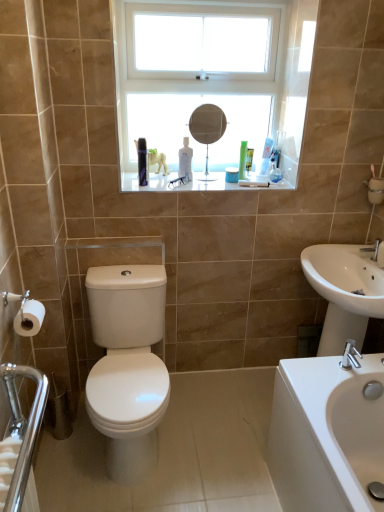
Question: Is white glass window at upper center at the back of translucent plastic toothbrush at upper center, the 2th toiletry positioned from the front?

Choices:
 (A) no
 (B) yes

Answer: (B)

Question: From the image's perspective, would you say translucent plastic toothbrush at upper center, which is counted as the 2th toiletry, starting from the bottom, is positioned over white glass window at upper center?

Choices:
 (A) yes
 (B) no

Answer: (B)

Question: From a real-world perspective, is translucent plastic toothbrush at upper center, the 2th toiletry positioned from the front, over white glass window at upper center?

Choices:
 (A) yes
 (B) no

Answer: (B)

Question: Can you confirm if translucent plastic toothbrush at upper center, which is the 2th toiletry from left to right, is wider than white glass window at upper center?

Choices:
 (A) yes
 (B) no

Answer: (B)

Question: Is the position of translucent plastic toothbrush at upper center, which is the 2th toiletry from left to right, less distant than that of white glass window at upper center?

Choices:
 (A) yes
 (B) no

Answer: (B)

Question: Visually, is white glossy sink at lower right, which appears as the first sink when ordered from the bottom, positioned to the left or to the right of polished chrome grab bar at lower left?

Choices:
 (A) right
 (B) left

Answer: (A)

Question: Is white glossy sink at lower right, which is the 2th sink in top-to-bottom order, wider or thinner than polished chrome grab bar at lower left?

Choices:
 (A) wide
 (B) thin

Answer: (A)

Question: Is point (306, 419) closer or farther from the camera than point (21, 471)?

Choices:
 (A) farther
 (B) closer

Answer: (A)

Question: Is white glossy sink at lower right, which is the 2th sink in top-to-bottom order, in front of or behind polished chrome grab bar at lower left in the image?

Choices:
 (A) front
 (B) behind

Answer: (B)

Question: In terms of width, does matte silver mirror at center look wider or thinner when compared to white glossy sink at right, the second sink in the bottom-to-top sequence?

Choices:
 (A) thin
 (B) wide

Answer: (A)

Question: Relative to white glossy sink at right, acting as the first sink starting from the top, is matte silver mirror at center in front or behind?

Choices:
 (A) behind
 (B) front

Answer: (A)

Question: From their relative heights in the image, would you say matte silver mirror at center is taller or shorter than white glossy sink at right, acting as the first sink starting from the top?

Choices:
 (A) tall
 (B) short

Answer: (A)

Question: From the image's perspective, is matte silver mirror at center positioned above or below white glossy sink at right, acting as the first sink starting from the top?

Choices:
 (A) above
 (B) below

Answer: (A)

Question: In terms of width, does white glass window at upper center look wider or thinner when compared to matte silver mirror at center?

Choices:
 (A) thin
 (B) wide

Answer: (B)

Question: In the image, is white glass window at upper center on the left side or the right side of matte silver mirror at center?

Choices:
 (A) left
 (B) right

Answer: (A)